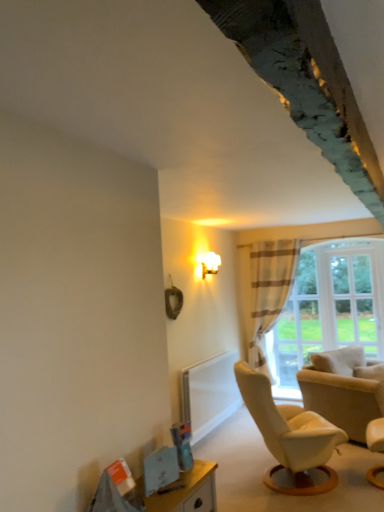
Question: Would you say white sheer curtain at center contains beige fabric chair at lower right, which is counted as the second chair, starting from the front?

Choices:
 (A) no
 (B) yes

Answer: (A)

Question: Can you confirm if white sheer curtain at center is positioned to the right of beige fabric chair at lower right, which is counted as the second chair, starting from the front?

Choices:
 (A) no
 (B) yes

Answer: (A)

Question: Can you confirm if white sheer curtain at center is thinner than beige fabric chair at lower right, which is counted as the second chair, starting from the front?

Choices:
 (A) no
 (B) yes

Answer: (B)

Question: From a real-world perspective, is white sheer curtain at center positioned over beige fabric chair at lower right, the 1th chair positioned from the back, based on gravity?

Choices:
 (A) no
 (B) yes

Answer: (B)

Question: Is beige fabric chair at lower right, which is counted as the second chair, starting from the front, at the back of white sheer curtain at center?

Choices:
 (A) no
 (B) yes

Answer: (A)

Question: Visually, is white leather chair at lower right, acting as the second chair starting from the back, positioned to the left or to the right of white sheer curtain at center?

Choices:
 (A) right
 (B) left

Answer: (A)

Question: Considering their positions, is white leather chair at lower right, marked as the first chair in a front-to-back arrangement, located in front of or behind white sheer curtain at center?

Choices:
 (A) behind
 (B) front

Answer: (B)

Question: From the image's perspective, is white leather chair at lower right, marked as the first chair in a front-to-back arrangement, located above or below white sheer curtain at center?

Choices:
 (A) below
 (B) above

Answer: (A)

Question: From a real-world perspective, is white leather chair at lower right, acting as the second chair starting from the back, physically located above or below white sheer curtain at center?

Choices:
 (A) below
 (B) above

Answer: (A)

Question: Is white sheer curtain at center spatially inside white leather chair at lower right, marked as the first chair in a front-to-back arrangement, or outside of it?

Choices:
 (A) outside
 (B) inside

Answer: (A)

Question: From a real-world perspective, is white sheer curtain at center physically located above or below white leather chair at lower right, acting as the second chair starting from the back?

Choices:
 (A) below
 (B) above

Answer: (B)

Question: Considering the positions of white sheer curtain at center and white leather chair at lower right, acting as the second chair starting from the back, in the image, is white sheer curtain at center wider or thinner than white leather chair at lower right, acting as the second chair starting from the back,?

Choices:
 (A) thin
 (B) wide

Answer: (B)

Question: Is white sheer curtain at center bigger or smaller than white leather chair at lower right, marked as the first chair in a front-to-back arrangement?

Choices:
 (A) small
 (B) big

Answer: (B)

Question: Looking at their shapes, would you say white sheer curtain at center is wider or thinner than clear glass window at right?

Choices:
 (A) thin
 (B) wide

Answer: (B)

Question: From a real-world perspective, relative to clear glass window at right, is white sheer curtain at center vertically above or below?

Choices:
 (A) above
 (B) below

Answer: (B)